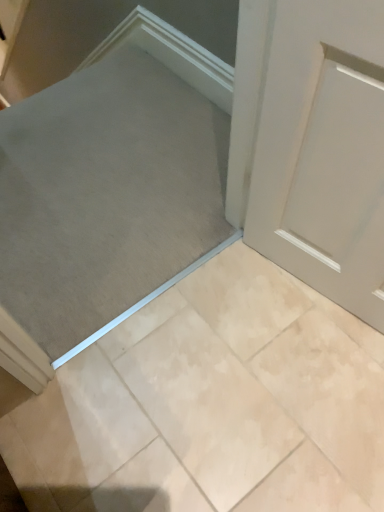
Question: Can you confirm if gray fabric at center is wider than beige marble tile at center?

Choices:
 (A) no
 (B) yes

Answer: (B)

Question: Is gray fabric at center to the right of beige marble tile at center from the viewer's perspective?

Choices:
 (A) no
 (B) yes

Answer: (A)

Question: Is gray fabric at center positioned in front of beige marble tile at center?

Choices:
 (A) yes
 (B) no

Answer: (B)

Question: Is gray fabric at center facing towards beige marble tile at center?

Choices:
 (A) yes
 (B) no

Answer: (B)

Question: Does gray fabric at center have a greater height compared to beige marble tile at center?

Choices:
 (A) yes
 (B) no

Answer: (B)

Question: From a real-world perspective, is gray fabric at center below beige marble tile at center?

Choices:
 (A) no
 (B) yes

Answer: (B)

Question: Is beige marble tile at center in contact with gray fabric at center?

Choices:
 (A) no
 (B) yes

Answer: (A)

Question: From the image's perspective, is beige marble tile at center located beneath gray fabric at center?

Choices:
 (A) yes
 (B) no

Answer: (A)

Question: From a real-world perspective, is beige marble tile at center over gray fabric at center?

Choices:
 (A) yes
 (B) no

Answer: (A)

Question: Can you confirm if beige marble tile at center is wider than gray fabric at center?

Choices:
 (A) no
 (B) yes

Answer: (A)

Question: Is beige marble tile at center not within gray fabric at center?

Choices:
 (A) yes
 (B) no

Answer: (A)

Question: From a real-world perspective, is beige marble tile at center below gray fabric at center?

Choices:
 (A) no
 (B) yes

Answer: (A)

Question: From a real-world perspective, is gray fabric at center positioned above or below beige marble tile at center?

Choices:
 (A) below
 (B) above

Answer: (A)